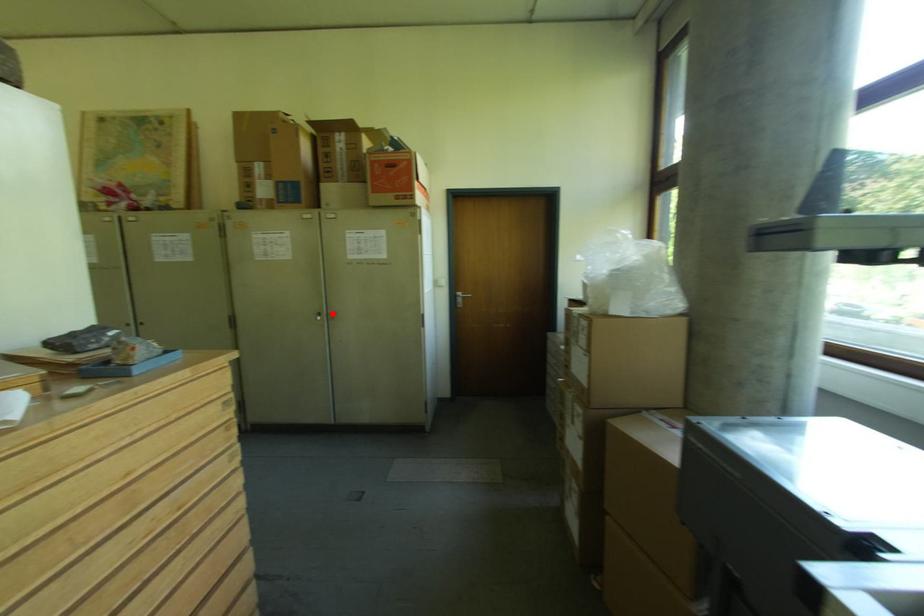
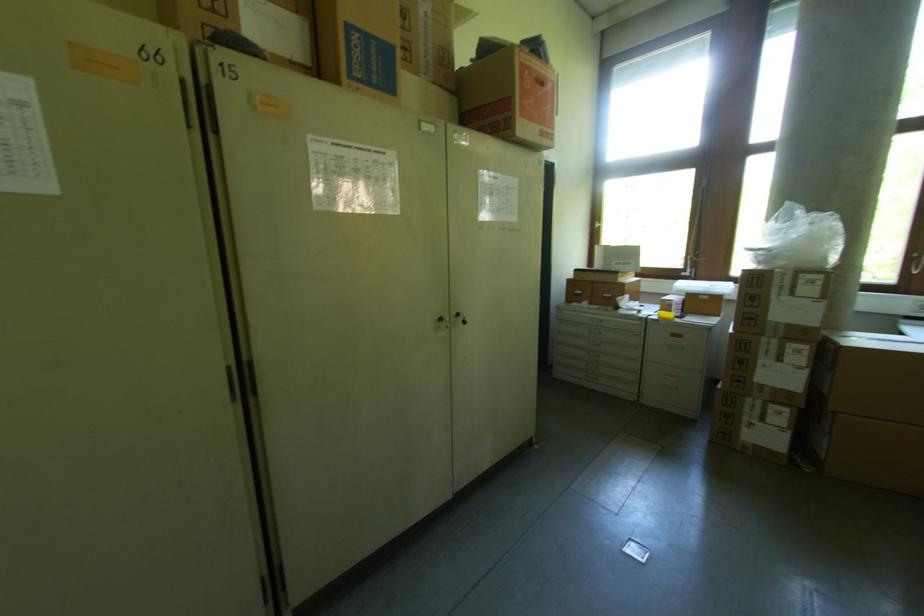
Find the pixel in the second image that matches the highlighted location in the first image.

(456, 315)